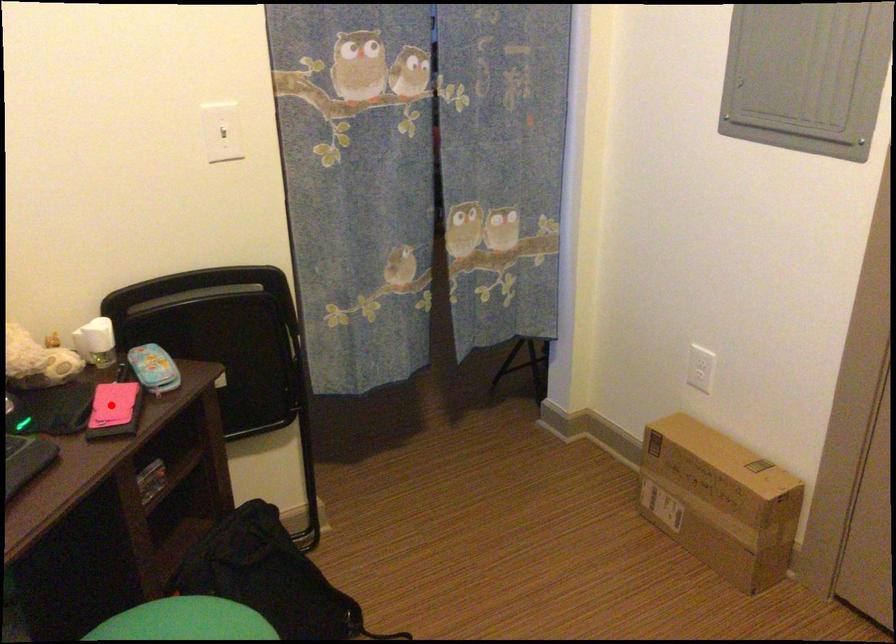
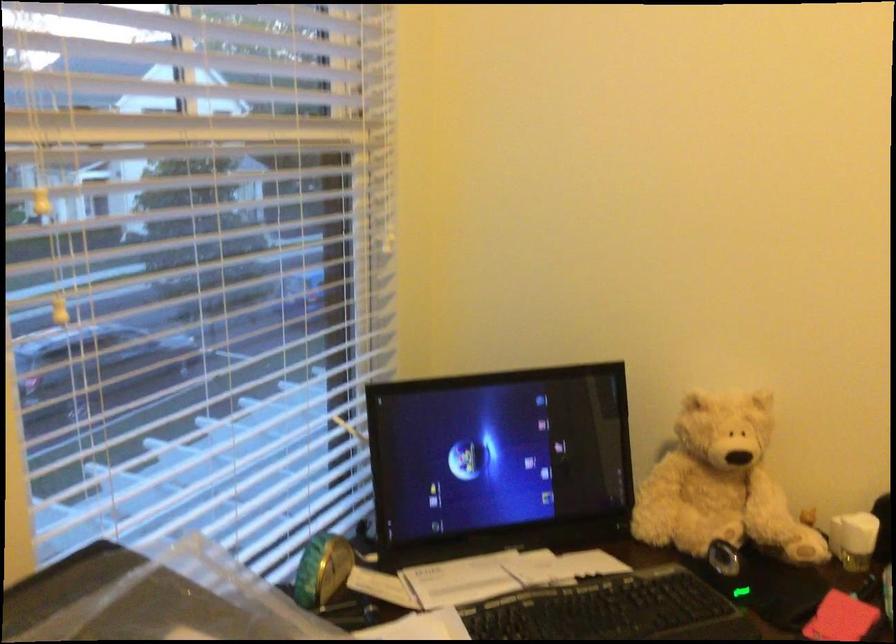
Locate, in the second image, the point that corresponds to the highlighted location in the first image.

(840, 618)